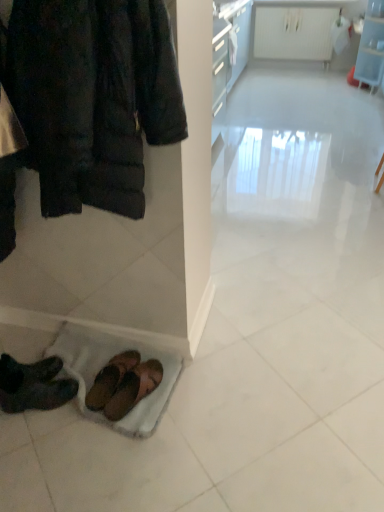
Question: Can you confirm if dark brown leather shoes at lower left, the 3th footwear when ordered from right to left, is smaller than white glossy radiator at upper center, the first shelf positioned from the left?

Choices:
 (A) no
 (B) yes

Answer: (B)

Question: Is dark brown leather shoes at lower left, the first footwear positioned from the left, facing towards white glossy radiator at upper center, the first shelf positioned from the left?

Choices:
 (A) no
 (B) yes

Answer: (A)

Question: From the image's perspective, is dark brown leather shoes at lower left, the 3th footwear when ordered from right to left, located beneath white glossy radiator at upper center, the second shelf from the right?

Choices:
 (A) yes
 (B) no

Answer: (A)

Question: Considering the relative sizes of dark brown leather shoes at lower left, the 3th footwear when ordered from right to left, and white glossy radiator at upper center, the second shelf from the right, in the image provided, is dark brown leather shoes at lower left, the 3th footwear when ordered from right to left, bigger than white glossy radiator at upper center, the second shelf from the right,?

Choices:
 (A) yes
 (B) no

Answer: (B)

Question: Is the surface of dark brown leather shoes at lower left, the 3th footwear when ordered from right to left, in direct contact with white glossy radiator at upper center, the second shelf from the right?

Choices:
 (A) no
 (B) yes

Answer: (A)

Question: From a real-world perspective, is dark brown leather shoes at lower left, the first footwear positioned from the left, on white glossy radiator at upper center, the first shelf positioned from the left?

Choices:
 (A) yes
 (B) no

Answer: (B)

Question: Considering the relative sizes of brown leather sandals at lower left, the first footwear viewed from the right, and dark brown leather shoes at lower left, the 3th footwear when ordered from right to left, in the image provided, is brown leather sandals at lower left, the first footwear viewed from the right, wider than dark brown leather shoes at lower left, the 3th footwear when ordered from right to left,?

Choices:
 (A) no
 (B) yes

Answer: (B)

Question: Could dark brown leather shoes at lower left, the 3th footwear when ordered from right to left, be considered to be inside brown leather sandals at lower left, the 3th footwear from the left?

Choices:
 (A) yes
 (B) no

Answer: (B)

Question: Is brown leather sandals at lower left, the 3th footwear from the left, in front of dark brown leather shoes at lower left, the first footwear positioned from the left?

Choices:
 (A) no
 (B) yes

Answer: (A)

Question: Does brown leather sandals at lower left, the 3th footwear from the left, have a smaller size compared to dark brown leather shoes at lower left, the first footwear positioned from the left?

Choices:
 (A) yes
 (B) no

Answer: (A)

Question: Is brown leather sandals at lower left, the first footwear viewed from the right, next to dark brown leather shoes at lower left, the 3th footwear when ordered from right to left, and touching it?

Choices:
 (A) no
 (B) yes

Answer: (A)

Question: Is brown leather sandals at lower left, the 3th footwear from the left, behind dark brown leather shoes at lower left, the first footwear positioned from the left?

Choices:
 (A) no
 (B) yes

Answer: (B)

Question: Is white glossy radiator at upper center, the first shelf positioned from the left, far from brown leather sandals at lower left, the first footwear viewed from the right?

Choices:
 (A) no
 (B) yes

Answer: (B)